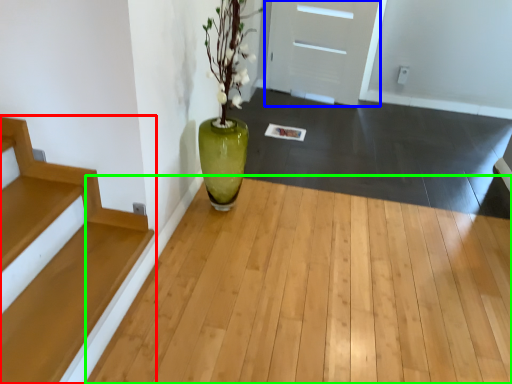
Question: Estimate the real-world distances between objects in this image. Which object is closer to stairs (highlighted by a red box), door (highlighted by a blue box) or corridor (highlighted by a green box)?

Choices:
 (A) door
 (B) corridor

Answer: (B)